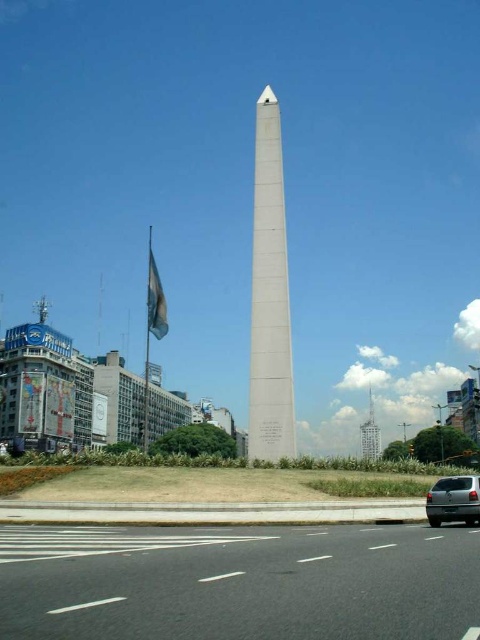
Between silver metallic van at lower right and white fabric flag at left, which one appears on the left side from the viewer's perspective?

white fabric flag at left

Between silver metallic van at lower right and white fabric flag at left, which one appears on the right side from the viewer's perspective?

Positioned to the right is silver metallic van at lower right.

Identify the location of silver metallic van at lower right. (454, 500).

This screenshot has height=640, width=480. I want to click on silver metallic van at lower right, so click(x=454, y=500).

Is point (76, 552) positioned behind point (274, 134)?

No, (76, 552) is in front of (274, 134).

Which is in front, point (233, 584) or point (275, 442)?

Point (233, 584) is more forward.

At what (x,y) coordinates should I click in order to perform the action: click on black asphalt road at lower center. Please return your answer as a coordinate pair (x, y). This screenshot has width=480, height=640. Looking at the image, I should click on (239, 582).

How distant is white fabric flag at left from smooth glass tower at right?

white fabric flag at left is 383.89 feet from smooth glass tower at right.

Can you confirm if white fabric flag at left is thinner than smooth glass tower at right?

No.

Which is in front, point (159, 289) or point (361, 433)?

Point (159, 289)

You are a GUI agent. You are given a task and a screenshot of the screen. Output one action in this format:
    pyautogui.click(x=<x>, y=<y>)
    Task: Click on the white fabric flag at left
    
    Given the screenshot: What is the action you would take?
    pyautogui.click(x=156, y=300)